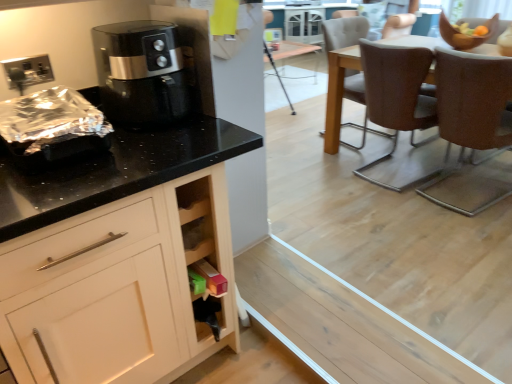
The height and width of the screenshot is (384, 512). I want to click on vacant space that's between brown leather chair at center, which is counted as the 2th chair, starting from the front, and brown leather chair at right, positioned as the 3th chair in back-to-front order, so click(x=432, y=177).